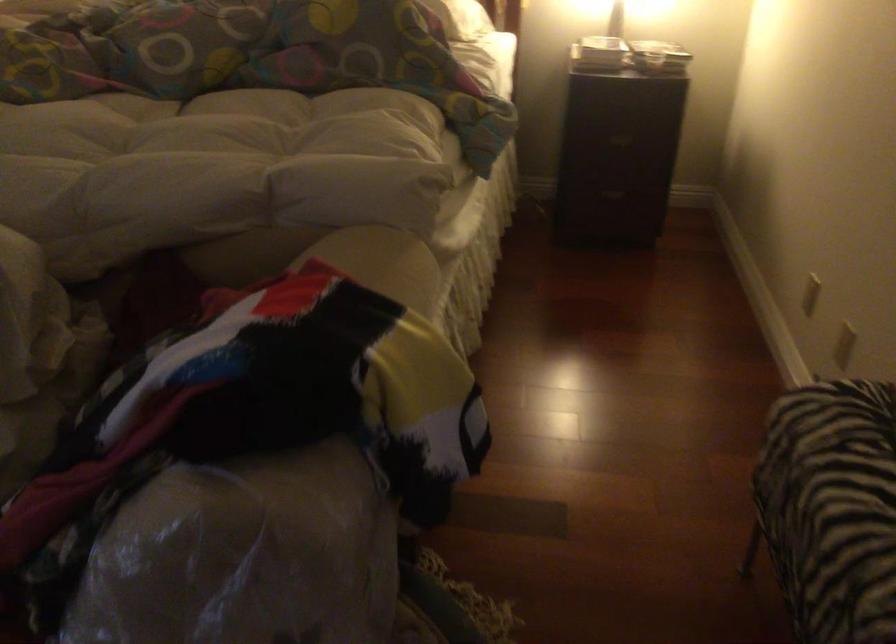
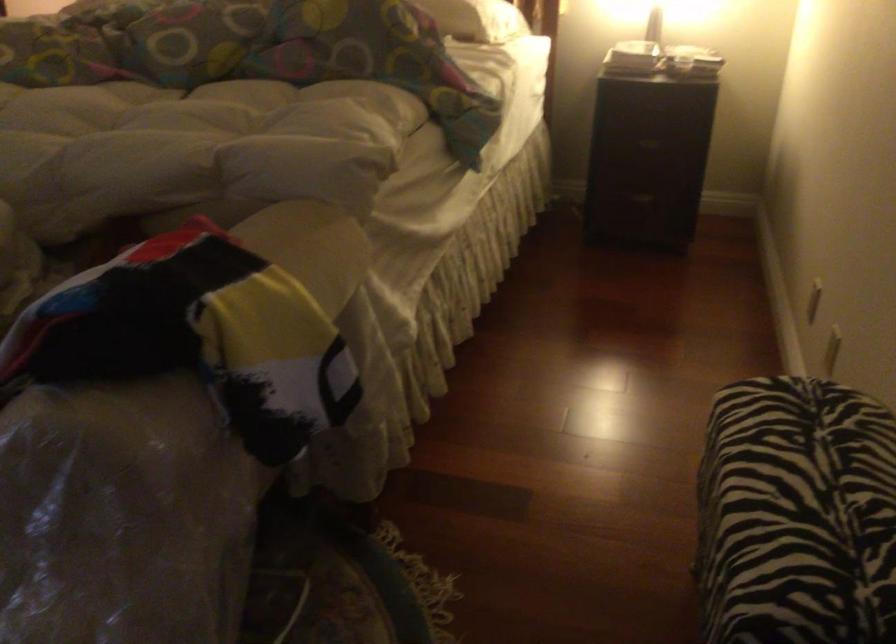
Question: The camera is either moving clockwise (left) or counter-clockwise (right) around the object. The first image is from the beginning of the video and the second image is from the end. Is the camera moving left or right when shooting the video?

Choices:
 (A) Left
 (B) Right

Answer: (B)